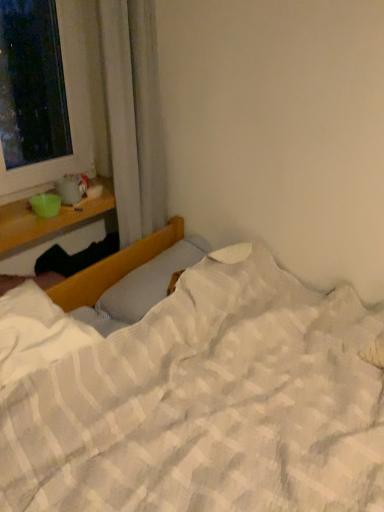
Measure the distance between white textured pillow at center and camera.

4.78 feet.

This screenshot has height=512, width=384. What do you see at coordinates (149, 282) in the screenshot?
I see `white textured pillow at center` at bounding box center [149, 282].

Locate an element on the screen. Image resolution: width=384 pixels, height=512 pixels. white textured pillow at center is located at coordinates (149, 282).

Find the location of a particular element. white textured pillow at center is located at coordinates (149, 282).